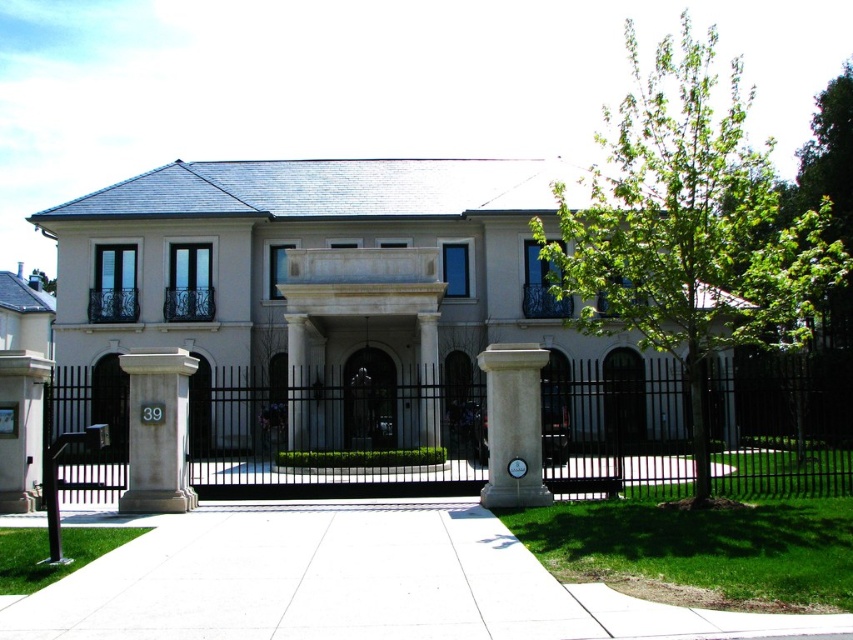
You are a delivery person approaching the house and need to park your van on the driveway. The van is 2 meters tall. Can you safely park it without hitting the white concrete pavement at center or the green leafy tree at upper right?

The white concrete pavement at center is not as tall as the green leafy tree at upper right, but since the pavement is at the center of the driveway, it might not obstruct the van. However, the green leafy tree at upper right could be taller than the van. To ensure safety, check the height of the tree. If the tree is taller than 2 meters, there might be a risk of hitting it. However, since the tree is at the upper right, it might be positioned away from the parking area. Without specific height details for

Looking at this image, you are a delivery person approaching the house and need to park your van. The van is 2 meters wide. The white concrete pavement at center and the green leafy tree at upper right are in your path. Can you fit your van between them?

The white concrete pavement at center is smaller than the green leafy tree at upper right. However, the description does not provide specific measurements of their sizes or the distance between them. Without knowing the exact dimensions, it is uncertain if the van can fit between them.

You are a visitor approaching the house and notice the black metal fence at center and the green leafy tree at upper right. Which object is closer to the entrance of the house?

The black metal fence at center is closer to the entrance of the house because it is located below the green leafy tree at upper right, indicating it is positioned lower in the scene and thus nearer to the entrance.